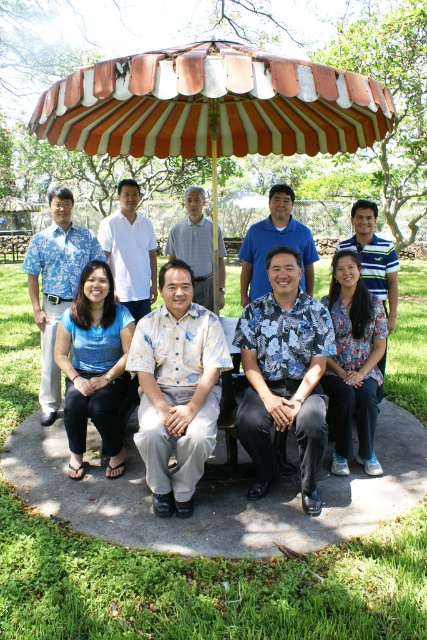
Question: Which point is closer to the camera?

Choices:
 (A) blue floral shirt at center
 (B) striped fabric umbrella at center

Answer: (B)

Question: Does striped fabric umbrella at center have a larger size compared to blue floral shirt at center?

Choices:
 (A) yes
 (B) no

Answer: (A)

Question: Does striped fabric umbrella at center appear under blue floral shirt at center?

Choices:
 (A) yes
 (B) no

Answer: (B)

Question: Which object appears closest to the camera in this image?

Choices:
 (A) striped fabric umbrella at center
 (B) blue floral shirt at center

Answer: (A)

Question: Is striped fabric umbrella at center further to camera compared to blue floral shirt at center?

Choices:
 (A) yes
 (B) no

Answer: (B)